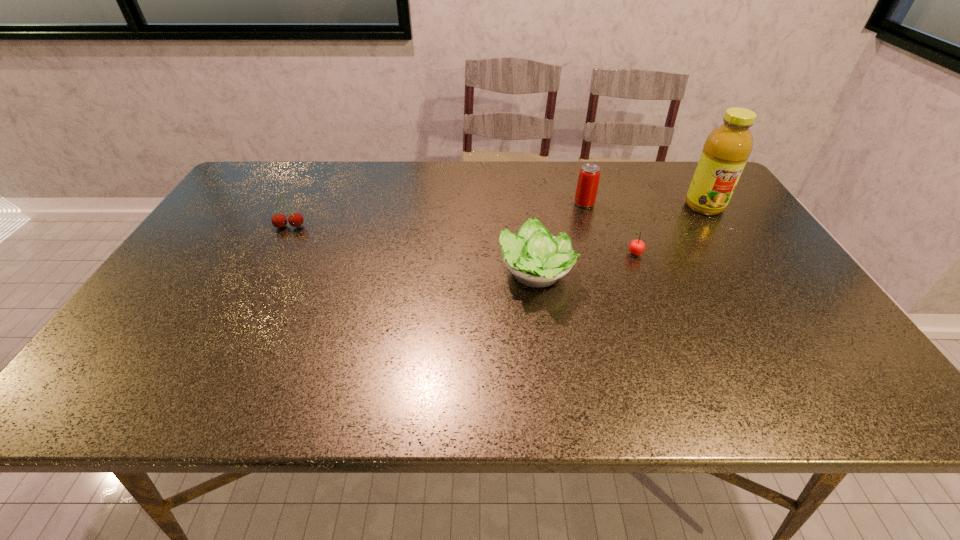
Where is `free space at the right edge`? free space at the right edge is located at coordinates (760, 248).

In order to click on free space at the far left corner in this screenshot , I will do `click(252, 172)`.

Identify the location of free region at the near left corner of the desktop. The image size is (960, 540). (137, 403).

Identify the location of vacant space at the near right corner. (814, 382).

The height and width of the screenshot is (540, 960). Find the location of `unoccupied position between the farther cherry and the fourth object from right to left`. unoccupied position between the farther cherry and the fourth object from right to left is located at coordinates (413, 251).

Identify the location of vacant space that's between the fourth object from right to left and the shortest object. This screenshot has width=960, height=540. (586, 265).

I want to click on free space between the lettuce and the leftmost object, so click(x=413, y=251).

In order to click on free area in between the leftmost object and the shorter cherry in this screenshot , I will do `click(463, 240)`.

Identify the location of vacant point located between the nearer cherry and the fourth object from right to left. (586, 265).

This screenshot has width=960, height=540. Identify the location of vacant area that lies between the lettuce and the fourth object from left to right. (586, 265).